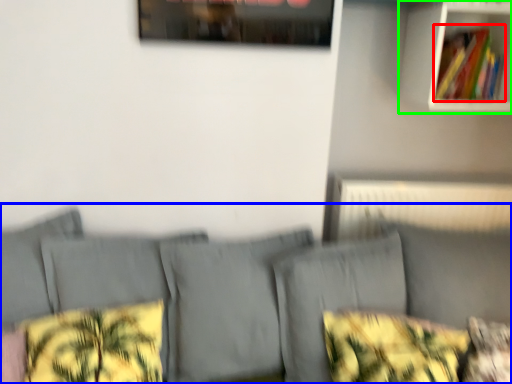
Question: Considering the real-world distances, which object is farthest from book (highlighted by a red box)? couch (highlighted by a blue box) or shelf (highlighted by a green box)?

Choices:
 (A) couch
 (B) shelf

Answer: (A)